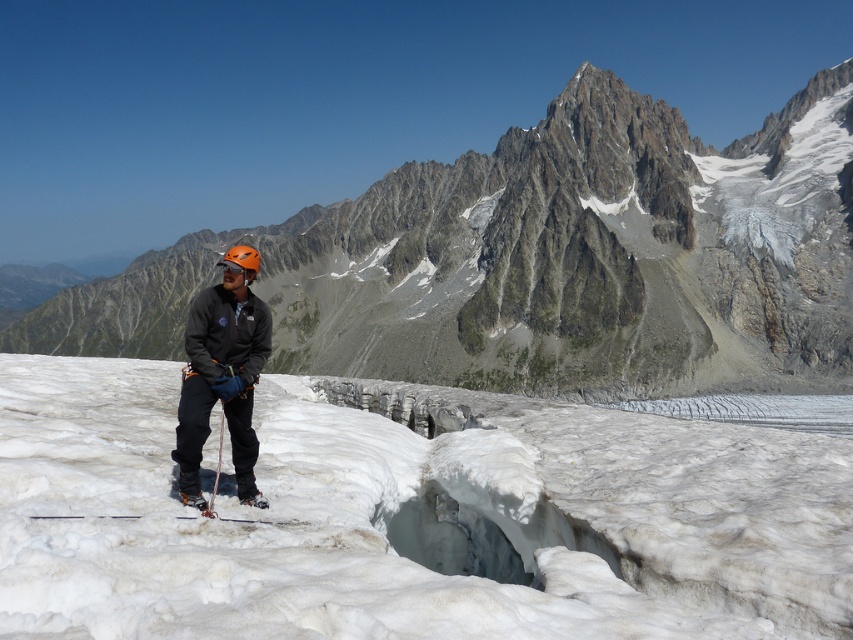
You are a mountain climber preparing to descend into the crevasse. You see the white frosty snow at center and the rugged granite mountain at center. Which object is positioned higher in the scene?

The rugged granite mountain at center is positioned higher than the white frosty snow at center, as the snow is located below the mountain.